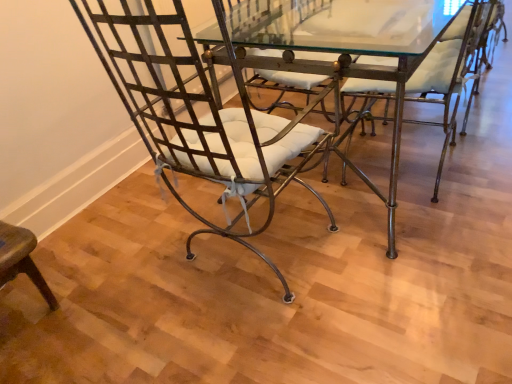
Identify the location of metallic wire chair at left, the 1th chair viewed from the left. (202, 119).

What do you see at coordinates (334, 50) in the screenshot? I see `metallic/glass table at center` at bounding box center [334, 50].

What do you see at coordinates (448, 72) in the screenshot?
I see `metallic wrought iron chair at center, which is the 2th chair from left to right` at bounding box center [448, 72].

This screenshot has height=384, width=512. Identify the location of metallic wire chair at left, which appears as the second chair when viewed from the right. (202, 119).

Is metallic/glass table at center taller than metallic wrought iron chair at center, the 1th chair when ordered from right to left?

In fact, metallic/glass table at center may be shorter than metallic wrought iron chair at center, the 1th chair when ordered from right to left.

Where is `table below the metallic wrought iron chair at center, which is the 2th chair from left to right (from a real-world perspective)`? This screenshot has height=384, width=512. table below the metallic wrought iron chair at center, which is the 2th chair from left to right (from a real-world perspective) is located at coordinates (334, 50).

Is there a large distance between metallic/glass table at center and metallic wrought iron chair at center, the 1th chair when ordered from right to left?

They are positioned close to each other.

Is metallic wire chair at left, the 1th chair viewed from the left, inside metallic wrought iron chair at center, the 1th chair when ordered from right to left?

That's incorrect, metallic wire chair at left, the 1th chair viewed from the left, is not inside metallic wrought iron chair at center, the 1th chair when ordered from right to left.

Is metallic wrought iron chair at center, which is the 2th chair from left to right, positioned far away from metallic wire chair at left, the 1th chair viewed from the left?

metallic wrought iron chair at center, which is the 2th chair from left to right, is actually quite close to metallic wire chair at left, the 1th chair viewed from the left.

Where is `chair that is above the metallic wrought iron chair at center, which is the 2th chair from left to right (from a real-world perspective)`? The height and width of the screenshot is (384, 512). chair that is above the metallic wrought iron chair at center, which is the 2th chair from left to right (from a real-world perspective) is located at coordinates (202, 119).

Is metallic wrought iron chair at center, which is the 2th chair from left to right, at the right side of metallic/glass table at center?

Correct, you'll find metallic wrought iron chair at center, which is the 2th chair from left to right, to the right of metallic/glass table at center.

Where is `table beneath the metallic wrought iron chair at center, which is the 2th chair from left to right (from a real-world perspective)`? This screenshot has width=512, height=384. table beneath the metallic wrought iron chair at center, which is the 2th chair from left to right (from a real-world perspective) is located at coordinates (334, 50).

In the image, is metallic wrought iron chair at center, the 1th chair when ordered from right to left, positioned in front of or behind metallic/glass table at center?

Visually, metallic wrought iron chair at center, the 1th chair when ordered from right to left, is located behind metallic/glass table at center.

In terms of width, does metallic wrought iron chair at center, which is the 2th chair from left to right, look wider or thinner when compared to metallic/glass table at center?

metallic wrought iron chair at center, which is the 2th chair from left to right, is thinner than metallic/glass table at center.

Which object is positioned more to the right, metallic/glass table at center or metallic wire chair at left, the 1th chair viewed from the left?

From the viewer's perspective, metallic/glass table at center appears more on the right side.

Is metallic/glass table at center taller than metallic wire chair at left, which appears as the second chair when viewed from the right?

Incorrect, the height of metallic/glass table at center is not larger of that of metallic wire chair at left, which appears as the second chair when viewed from the right.

How far apart are metallic/glass table at center and metallic wire chair at left, which appears as the second chair when viewed from the right?

metallic/glass table at center is 26.50 inches from metallic wire chair at left, which appears as the second chair when viewed from the right.

Is metallic wire chair at left, the 1th chair viewed from the left, turned away from metallic wrought iron chair at center, which is the 2th chair from left to right?

metallic wire chair at left, the 1th chair viewed from the left, does not have its back to metallic wrought iron chair at center, which is the 2th chair from left to right.

Is the position of metallic wire chair at left, which appears as the second chair when viewed from the right, more distant than that of metallic wrought iron chair at center, the 1th chair when ordered from right to left?

No, the depth of metallic wire chair at left, which appears as the second chair when viewed from the right, is less than that of metallic wrought iron chair at center, the 1th chair when ordered from right to left.

Are metallic wire chair at left, which appears as the second chair when viewed from the right, and metallic wrought iron chair at center, the 1th chair when ordered from right to left, far apart?

metallic wire chair at left, which appears as the second chair when viewed from the right, is near metallic wrought iron chair at center, the 1th chair when ordered from right to left, not far away.

You are a GUI agent. You are given a task and a screenshot of the screen. Output one action in this format:
    pyautogui.click(x=<x>, y=<y>)
    Task: Click on the chair to the right of metallic wire chair at left, which appears as the second chair when viewed from the right
    This screenshot has width=512, height=384.
    Given the screenshot: What is the action you would take?
    pyautogui.click(x=448, y=72)

Is metallic wire chair at left, which appears as the second chair when viewed from the right, far from metallic/glass table at center?

No, metallic wire chair at left, which appears as the second chair when viewed from the right, is not far away from metallic/glass table at center.

Is metallic wire chair at left, the 1th chair viewed from the left, not within metallic/glass table at center?

Absolutely, metallic wire chair at left, the 1th chair viewed from the left, is external to metallic/glass table at center.

Image resolution: width=512 pixels, height=384 pixels. In the image, there is a metallic wire chair at left, the 1th chair viewed from the left. Find the location of `table above it (from the image's perspective)`. table above it (from the image's perspective) is located at coordinates (334, 50).

Does point (207, 169) appear closer or farther from the camera than point (438, 25)?

Point (207, 169) is closer to the camera than point (438, 25).

Locate an element on the screen. The height and width of the screenshot is (384, 512). table in front of the metallic wrought iron chair at center, which is the 2th chair from left to right is located at coordinates (334, 50).

Identify the location of chair above the metallic wrought iron chair at center, which is the 2th chair from left to right (from a real-world perspective). (202, 119).

Considering their positions, is metallic wire chair at left, the 1th chair viewed from the left, positioned further to metallic wrought iron chair at center, the 1th chair when ordered from right to left, than metallic/glass table at center?

Among the two, metallic wire chair at left, the 1th chair viewed from the left, is located further to metallic wrought iron chair at center, the 1th chair when ordered from right to left.

Estimate the real-world distances between objects in this image. Which object is closer to metallic wrought iron chair at center, the 1th chair when ordered from right to left, metallic/glass table at center or metallic wire chair at left, which appears as the second chair when viewed from the right?

metallic/glass table at center.

Based on their spatial positions, is metallic/glass table at center or metallic wrought iron chair at center, which is the 2th chair from left to right, closer to metallic wire chair at left, the 1th chair viewed from the left?

Among the two, metallic wrought iron chair at center, which is the 2th chair from left to right, is located nearer to metallic wire chair at left, the 1th chair viewed from the left.

In the scene shown: When comparing their distances from metallic/glass table at center, does metallic wrought iron chair at center, which is the 2th chair from left to right, or metallic wire chair at left, which appears as the second chair when viewed from the right, seem further?

metallic wire chair at left, which appears as the second chair when viewed from the right.

When comparing their distances from metallic/glass table at center, does metallic wire chair at left, the 1th chair viewed from the left, or metallic wrought iron chair at center, the 1th chair when ordered from right to left, seem further?

metallic wire chair at left, the 1th chair viewed from the left.

Looking at the image, which one is located further to metallic wire chair at left, which appears as the second chair when viewed from the right, metallic wrought iron chair at center, which is the 2th chair from left to right, or metallic/glass table at center?

metallic/glass table at center is further to metallic wire chair at left, which appears as the second chair when viewed from the right.

The image size is (512, 384). In order to click on table located between metallic wire chair at left, the 1th chair viewed from the left, and metallic wrought iron chair at center, the 1th chair when ordered from right to left, in the left-right direction in this screenshot , I will do `click(334, 50)`.